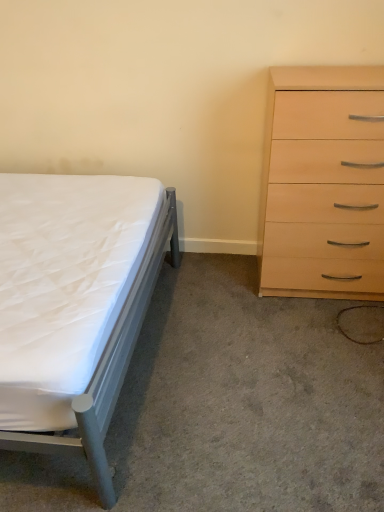
You are a GUI agent. You are given a task and a screenshot of the screen. Output one action in this format:
    pyautogui.click(x=<x>, y=<y>)
    Task: Click on the blank space to the left of light wood/finish chest of drawers at right
    
    Given the screenshot: What is the action you would take?
    click(x=222, y=295)